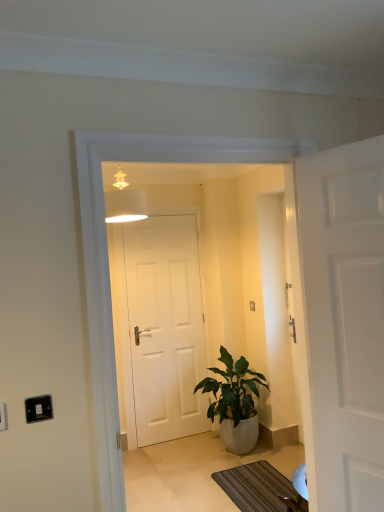
Question: Is point (264, 477) positioned closer to the camera than point (0, 422)?

Choices:
 (A) farther
 (B) closer

Answer: (A)

Question: In the image, is striped fabric doormat at lower center positioned in front of or behind white plastic electric outlet at lower left, positioned as the 2th electric outlet in back-to-front order?

Choices:
 (A) front
 (B) behind

Answer: (B)

Question: Which of these objects is positioned farthest from the striped fabric doormat at lower center?

Choices:
 (A) white matte door at right, which appears as the 2th door when viewed from the back
 (B) matte white lampshade at upper center
 (C) white matte door at center, the 1th door viewed from the left
 (D) green glossy plant at center
 (E) white plastic electric outlet at lower left, positioned as the 1th electric outlet in left-to-right order

Answer: (E)

Question: Which object is the closest to the black plastic switch at lower left, acting as the 1th electric outlet starting from the back?

Choices:
 (A) white matte door at right, which appears as the 2th door when viewed from the back
 (B) striped fabric doormat at lower center
 (C) white matte door at center, the second door viewed from the front
 (D) white plastic electric outlet at lower left, which is the 1th electric outlet in front-to-back order
 (E) matte white lampshade at upper center

Answer: (D)